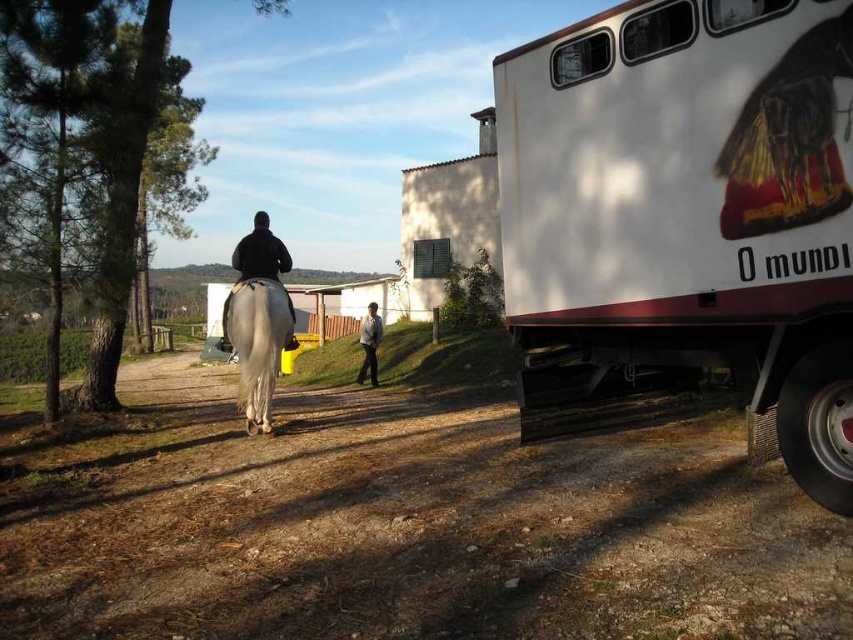
You are a delivery driver who needs to load a light gray fabric jacket at center onto a white glossy trailer truck at right. Based on the size of the jacket and the trailer, will the jacket fit inside the trailer?

The white glossy trailer truck at right is larger in size than the light gray fabric jacket at center, so the jacket will fit inside the trailer.